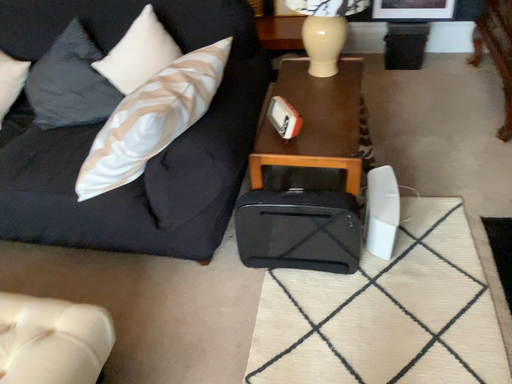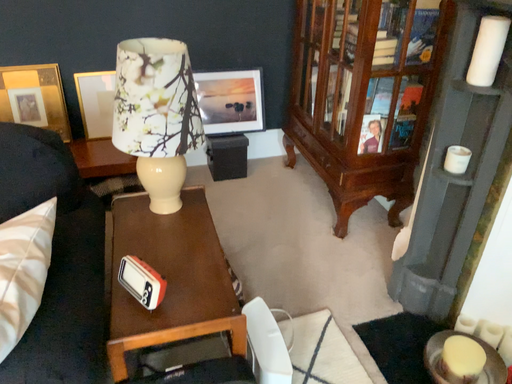
Question: Which way did the camera rotate in the video?

Choices:
 (A) rotated left
 (B) rotated right

Answer: (B)